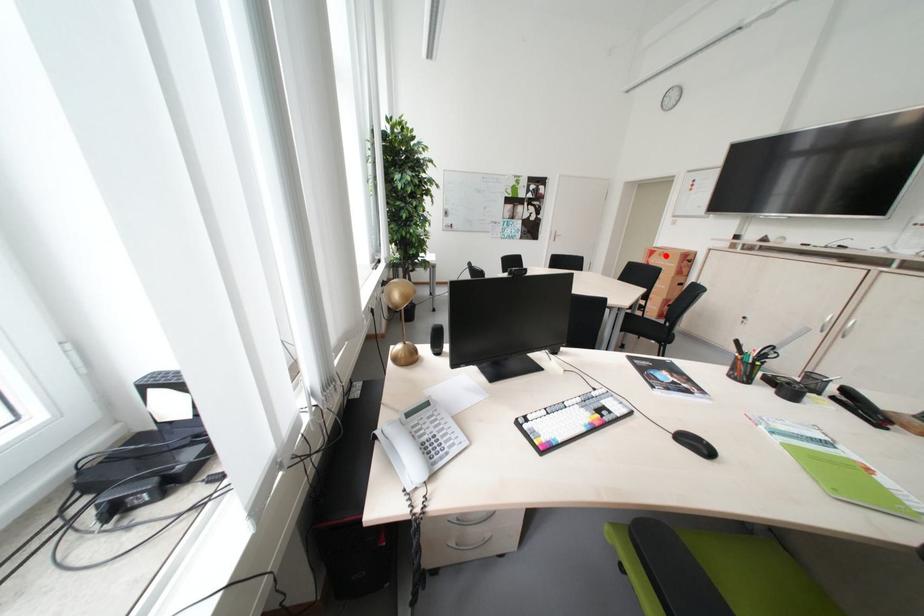
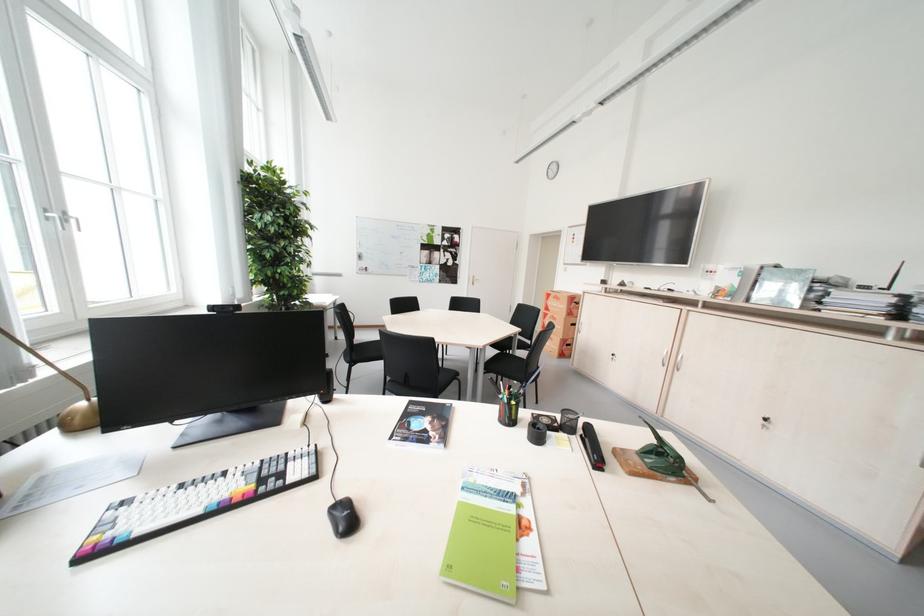
Question: I am providing you with two images of the same scene from different viewpoints. In image1, a red point is highlighted. Considering the same 3D point in image2, which of the following is correct?

Choices:
 (A) It is closer
 (B) It is farther

Answer: (A)